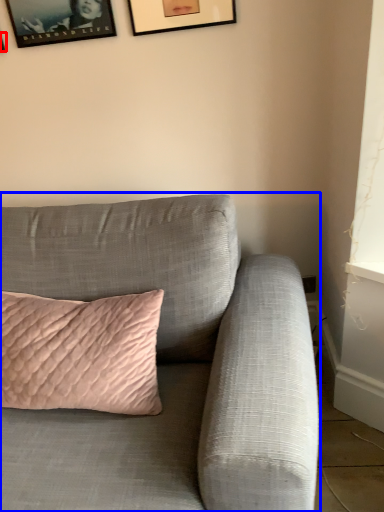
Question: Which object is closer to the camera taking this photo, picture frame (highlighted by a red box) or studio couch (highlighted by a blue box)?

Choices:
 (A) picture frame
 (B) studio couch

Answer: (B)